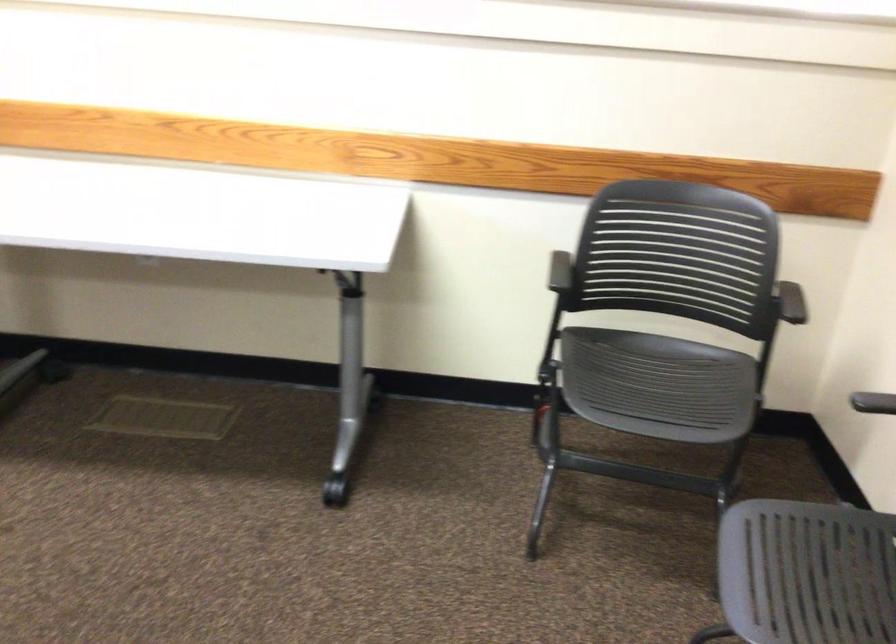
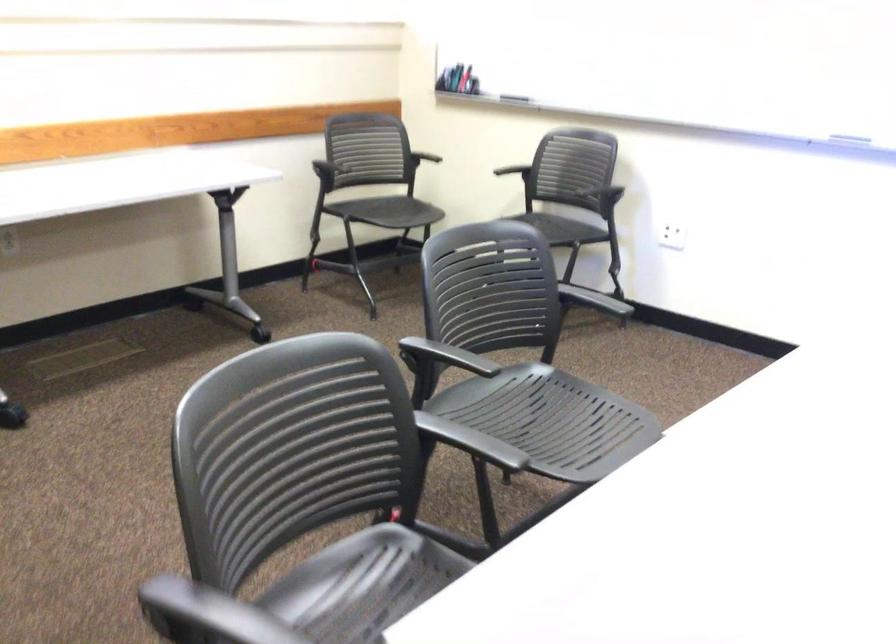
Question: I am providing you with two images of the same scene from different viewpoints. After the viewpoint changes to image2, which objects are now occluded?

Choices:
 (A) black chair sitting surface
 (B) stall door latch
 (C) chair sitting surface
 (D) black chair armrest

Answer: (A)